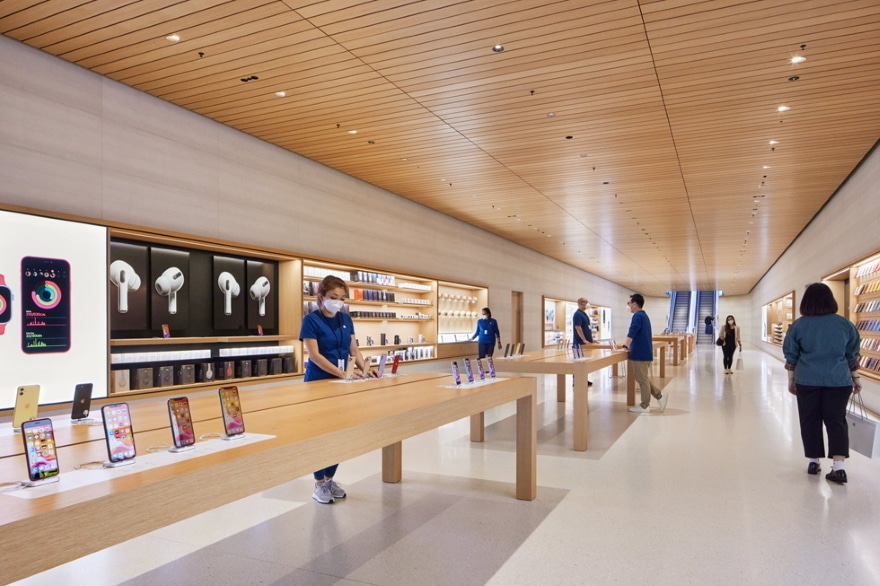
This screenshot has height=586, width=880. I want to click on display screen, so click(x=81, y=354).